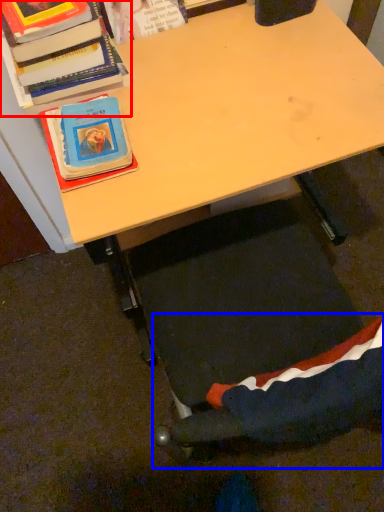
Question: Which point is further to the camera, book (highlighted by a red box) or swivel chair (highlighted by a blue box)?

Choices:
 (A) book
 (B) swivel chair

Answer: (A)